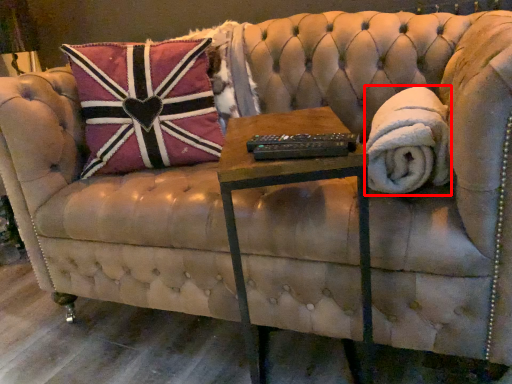
Question: From the image's perspective, what is the correct spatial positioning of blanket (annotated by the red box) in reference to table?

Choices:
 (A) below
 (B) above

Answer: (B)